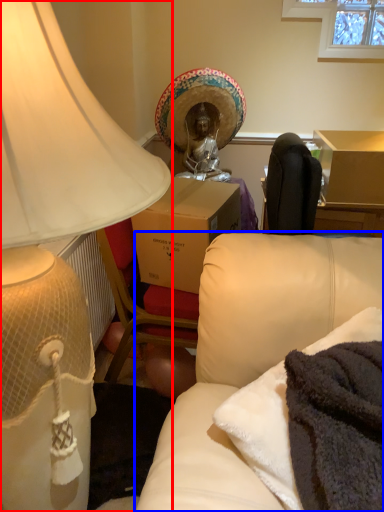
Question: Which object appears closest to the camera in this image, lamp (highlighted by a red box) or studio couch (highlighted by a blue box)?

Choices:
 (A) lamp
 (B) studio couch

Answer: (A)